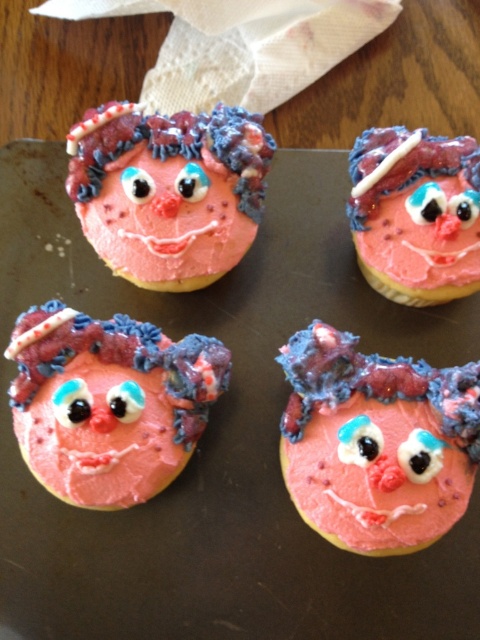
Looking at the cupcakes on the baking sheet, which one is positioned to the left of the other between the pink matte cookie at upper left and the pink matte cookie at upper right?

The pink matte cookie at upper left is positioned to the left of the pink matte cookie at upper right.

You are a customer at a bakery and want to take a photo of the cupcakes. You notice two points on the cupcakes at coordinates point (169, 476) and point (101, 214). Which point should you focus on to ensure the cupcake in front is in focus?

You should focus on point (169, 476) because it is in front of point (101, 214), so focusing there will keep the closer cupcake in focus.

You are a baker arranging cupcakes on a baking sheet. You have a pink matte cookie at center and a pink matte cookie at lower left. Which cookie is located more to the right side?

The pink matte cookie at center is positioned on the right side of the pink matte cookie at lower left, so it is more to the right.